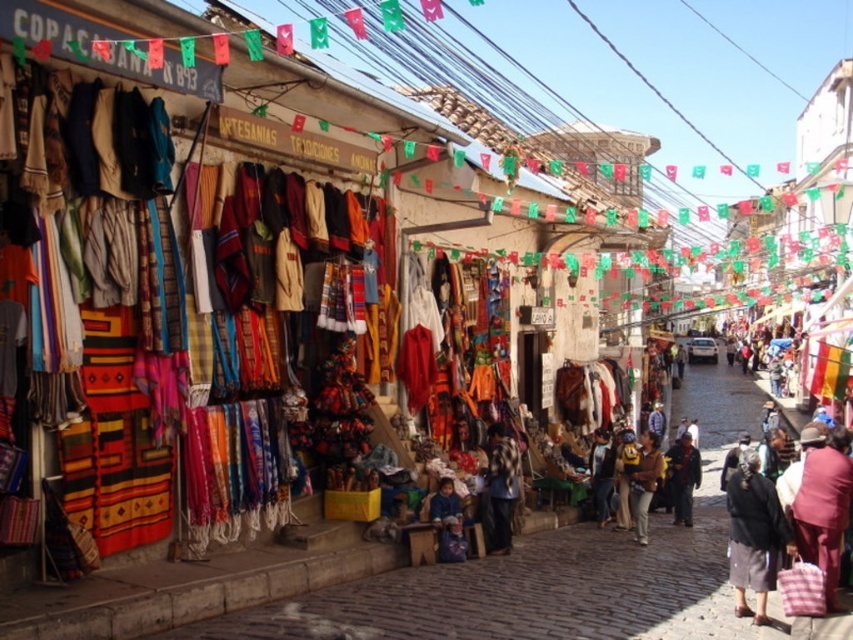
You are a traveler shopping for a jacket in this market. You see both the brown leather jacket at center and the dark blue jacket at center. Which one is smaller in size?

The brown leather jacket at center is smaller than the dark blue jacket at center.

In the scene shown: You are a customer at this market and want to buy both the dark brown fabric skirt at lower right and the brown leather jacket at center. However, you have a height restriction in your suitcase. Which item will you need to check if it fits before purchasing?

The dark brown fabric skirt at lower right is much taller than the brown leather jacket at center, so you should check the height of the dark brown fabric skirt at lower right first to ensure it fits in your suitcase.

From the picture: You are a customer at the market and want to buy a jacket. You see both the brown leather jacket at center and the dark blue jacket at center. Which jacket is located lower in the display?

The brown leather jacket at center is positioned under the dark blue jacket at center, so it is located lower in the display.